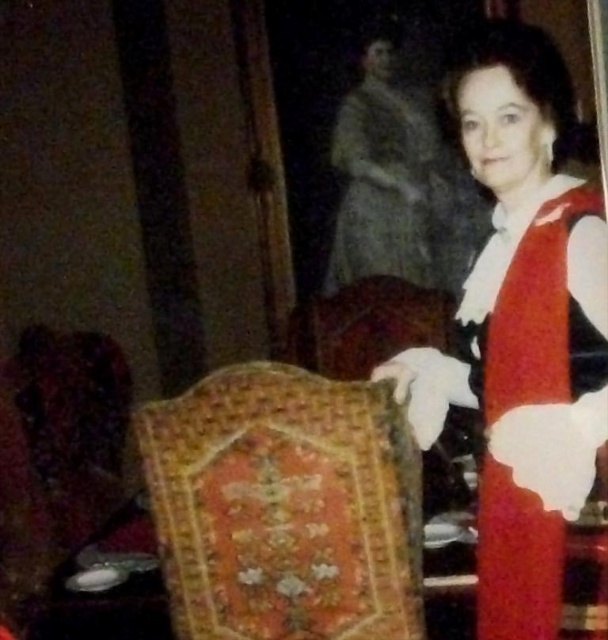
Between matte red dress at right and embroidered velvet armchair at center, which one is positioned lower?

embroidered velvet armchair at center is lower down.

Which is in front, point (511, 586) or point (201, 449)?

Point (511, 586) is in front.

Where is `matte red dress at right`? This screenshot has height=640, width=608. matte red dress at right is located at coordinates pyautogui.click(x=522, y=326).